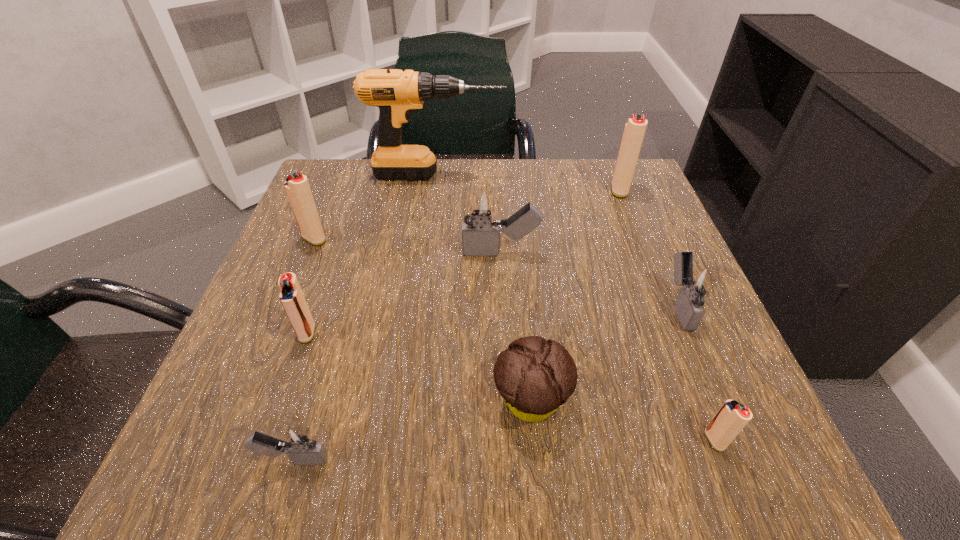
At what (x,y) coordinates should I click in order to perform the action: click on the tallest object. Please return your answer as a coordinate pair (x, y). This screenshot has height=540, width=960. Looking at the image, I should click on (396, 93).

Locate an element on the screen. The height and width of the screenshot is (540, 960). the tallest igniter is located at coordinates (635, 128).

The image size is (960, 540). I want to click on the eighth shortest object, so click(x=635, y=128).

This screenshot has width=960, height=540. Identify the location of the second biggest red igniter. [297, 187].

At what (x,y) coordinates should I click in order to perform the action: click on the leftmost igniter. Please return your answer as a coordinate pair (x, y). This screenshot has height=540, width=960. Looking at the image, I should click on (297, 187).

At what (x,y) coordinates should I click in order to perform the action: click on the second gray igniter from right to left. Please return your answer as a coordinate pair (x, y). Looking at the image, I should click on (479, 206).

Find the location of a particular element. The width and height of the screenshot is (960, 540). the fourth igniter from right to left is located at coordinates (479, 206).

The image size is (960, 540). I want to click on the rightmost gray igniter, so click(x=696, y=282).

The height and width of the screenshot is (540, 960). Find the location of `the second farthest gray igniter`. the second farthest gray igniter is located at coordinates (696, 282).

The height and width of the screenshot is (540, 960). In order to click on the third biggest red igniter in this screenshot , I will do `click(291, 296)`.